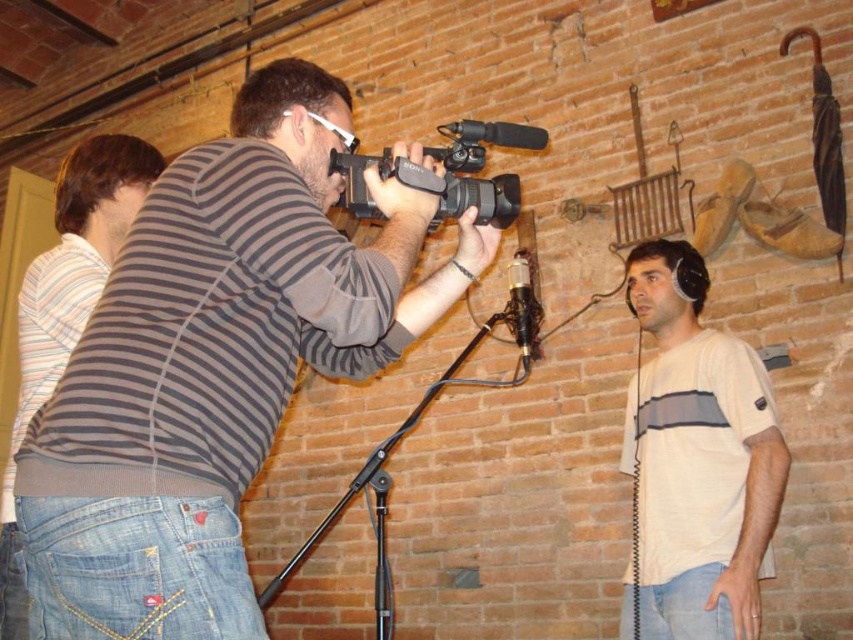
From the picture: Does striped sweater at center have a larger size compared to black plastic video camera at center?

Yes, striped sweater at center is bigger than black plastic video camera at center.

Does striped sweater at center lie behind black plastic video camera at center?

No, striped sweater at center is in front of black plastic video camera at center.

Who is more distant from viewer, (129, 320) or (515, 189)?

Point (515, 189)

Image resolution: width=853 pixels, height=640 pixels. I want to click on striped sweater at center, so click(x=213, y=365).

Which of these two, white cotton t-shirt at right or denim jeans at left, stands shorter?

white cotton t-shirt at right is shorter.

Can you confirm if white cotton t-shirt at right is positioned below denim jeans at left?

Yes.

The width and height of the screenshot is (853, 640). Find the location of `white cotton t-shirt at right`. white cotton t-shirt at right is located at coordinates (697, 460).

Who is more forward, (688, 480) or (462, 125)?

Point (462, 125)

Is white cotton t-shirt at right closer to camera compared to black plastic video camera at center?

No.

Is point (728, 445) positioned after point (460, 184)?

Yes, point (728, 445) is farther from viewer.

Locate an element on the screen. white cotton t-shirt at right is located at coordinates (697, 460).